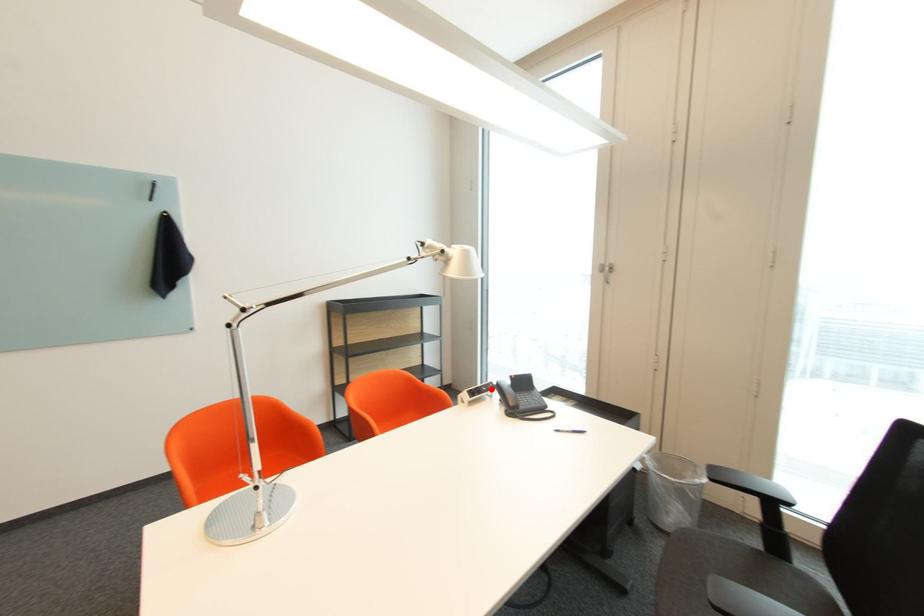
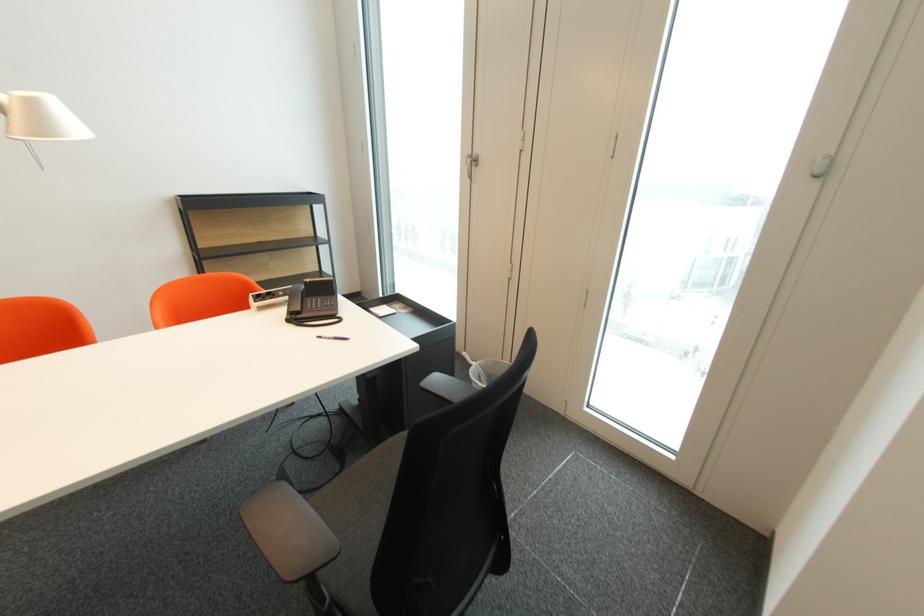
The point at the highlighted location is marked in the first image. Where is the corresponding point in the second image?

(287, 294)